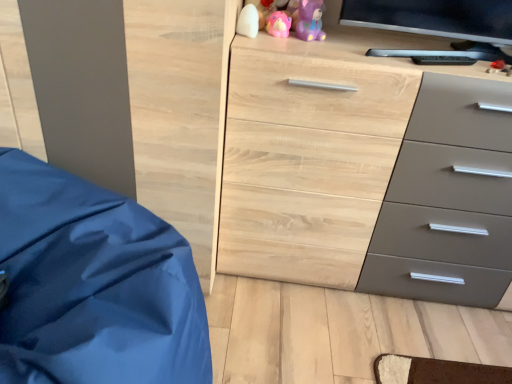
This screenshot has height=384, width=512. I want to click on light wood/texture chest of drawers at center, so click(312, 152).

This screenshot has width=512, height=384. Describe the element at coordinates (93, 285) in the screenshot. I see `blue fabric at left` at that location.

Identify the location of blue fabric at left. (93, 285).

Find the location of a particular element. The width and height of the screenshot is (512, 384). light wood/texture chest of drawers at center is located at coordinates (312, 152).

Which object is further away from the camera, blue fabric at left or white matte pillow at upper center, which appears as the 1th toy when viewed from the left?

white matte pillow at upper center, which appears as the 1th toy when viewed from the left, is more distant.

Can you see blue fabric at left touching white matte pillow at upper center, the 3th toy in the right-to-left sequence?

→ No, blue fabric at left is not touching white matte pillow at upper center, the 3th toy in the right-to-left sequence.

Does blue fabric at left have a lesser height compared to white matte pillow at upper center, which appears as the 1th toy when viewed from the left?

No.

Considering the relative sizes of blue fabric at left and white matte pillow at upper center, which appears as the 1th toy when viewed from the left, in the image provided, is blue fabric at left wider than white matte pillow at upper center, which appears as the 1th toy when viewed from the left,?

Indeed, blue fabric at left has a greater width compared to white matte pillow at upper center, which appears as the 1th toy when viewed from the left.

From a real-world perspective, is blue fabric at left above or below light wood/texture chest of drawers at center?

In terms of real-world spatial position, blue fabric at left is below light wood/texture chest of drawers at center.

Does blue fabric at left have a smaller size compared to light wood/texture chest of drawers at center?

Yes, blue fabric at left is smaller than light wood/texture chest of drawers at center.

Considering the sizes of objects blue fabric at left and light wood/texture chest of drawers at center in the image provided, who is shorter, blue fabric at left or light wood/texture chest of drawers at center?

blue fabric at left is shorter.

Would you say blue fabric at left is a long distance from light wood/texture chest of drawers at center?

That's not correct — blue fabric at left is a little close to light wood/texture chest of drawers at center.

Which object is closer to the camera taking this photo, light wood/texture chest of drawers at center or pink rubber duck at upper center, which is counted as the 2th toy, starting from the right?

light wood/texture chest of drawers at center is more forward.

Identify the location of the chest of drawers that is under the pink rubber duck at upper center, which is counted as the 2th toy, starting from the right (from a real-world perspective). (312, 152).

From the image's perspective, which object appears higher, light wood/texture chest of drawers at center or pink rubber duck at upper center, the second toy from the left?

pink rubber duck at upper center, the second toy from the left.

Considering the relative sizes of light wood/texture chest of drawers at center and pink rubber duck at upper center, which is counted as the 2th toy, starting from the right, in the image provided, is light wood/texture chest of drawers at center bigger than pink rubber duck at upper center, which is counted as the 2th toy, starting from the right,?

Yes.

Is white matte pillow at upper center, which appears as the 1th toy when viewed from the left, wider or thinner than blue fabric at left?

In the image, white matte pillow at upper center, which appears as the 1th toy when viewed from the left, appears to be more narrow than blue fabric at left.

Is white matte pillow at upper center, which appears as the 1th toy when viewed from the left, inside or outside of blue fabric at left?

white matte pillow at upper center, which appears as the 1th toy when viewed from the left, lies outside blue fabric at left.

Which of these two, white matte pillow at upper center, the 3th toy in the right-to-left sequence, or blue fabric at left, is bigger?

With larger size is blue fabric at left.

The image size is (512, 384). I want to click on furniture that appears in front of the white matte pillow at upper center, the 3th toy in the right-to-left sequence, so click(x=93, y=285).

Can you tell me how much white matte pillow at upper center, the 3th toy in the right-to-left sequence, and purple matte bear at upper center, acting as the first toy starting from the right, differ in facing direction?

There is a 0.000838-degree angle between the facing directions of white matte pillow at upper center, the 3th toy in the right-to-left sequence, and purple matte bear at upper center, acting as the first toy starting from the right.

From a real-world perspective, is white matte pillow at upper center, the 3th toy in the right-to-left sequence, above or below purple matte bear at upper center, the third toy when ordered from left to right?

white matte pillow at upper center, the 3th toy in the right-to-left sequence, is situated lower than purple matte bear at upper center, the third toy when ordered from left to right, in the real world.

Is white matte pillow at upper center, the 3th toy in the right-to-left sequence, bigger than purple matte bear at upper center, the third toy when ordered from left to right?

No, white matte pillow at upper center, the 3th toy in the right-to-left sequence, is not bigger than purple matte bear at upper center, the third toy when ordered from left to right.

You are a GUI agent. You are given a task and a screenshot of the screen. Output one action in this format:
    pyautogui.click(x=<x>, y=<y>)
    Task: Click on the toy that is the 2nd object located below the purple matte bear at upper center, the third toy when ordered from left to right (from the image's perspective)
    
    Given the screenshot: What is the action you would take?
    pyautogui.click(x=248, y=21)

Are purple matte bear at upper center, acting as the first toy starting from the right, and pink rubber duck at upper center, which is counted as the 2th toy, starting from the right, far apart?

No, purple matte bear at upper center, acting as the first toy starting from the right, is in close proximity to pink rubber duck at upper center, which is counted as the 2th toy, starting from the right.

From a real-world perspective, who is located higher, purple matte bear at upper center, the third toy when ordered from left to right, or pink rubber duck at upper center, the second toy from the left?

From a 3D spatial view, purple matte bear at upper center, the third toy when ordered from left to right, is above.

Is purple matte bear at upper center, the third toy when ordered from left to right, turned away from pink rubber duck at upper center, the second toy from the left?

No, purple matte bear at upper center, the third toy when ordered from left to right, is not facing away from pink rubber duck at upper center, the second toy from the left.

How different are the orientations of light wood/texture chest of drawers at center and blue fabric at left in degrees?

They differ by 0.344 degrees in their facing directions.

Which is behind, light wood/texture chest of drawers at center or blue fabric at left?

light wood/texture chest of drawers at center is further from the camera.

In the image, is light wood/texture chest of drawers at center on the left side or the right side of blue fabric at left?

light wood/texture chest of drawers at center is to the right of blue fabric at left.

In the scene shown: Considering the sizes of objects light wood/texture chest of drawers at center and blue fabric at left in the image provided, who is taller, light wood/texture chest of drawers at center or blue fabric at left?

light wood/texture chest of drawers at center is taller.

The width and height of the screenshot is (512, 384). In the image, there is a white matte pillow at upper center, which appears as the 1th toy when viewed from the left. Identify the location of furniture below it (from a real-world perspective). (93, 285).

Image resolution: width=512 pixels, height=384 pixels. I want to click on furniture in front of the light wood/texture chest of drawers at center, so click(x=93, y=285).

Considering their positions, is light wood/texture chest of drawers at center positioned closer to pink rubber duck at upper center, which is counted as the 2th toy, starting from the right, than white matte pillow at upper center, which appears as the 1th toy when viewed from the left?

white matte pillow at upper center, which appears as the 1th toy when viewed from the left.

Which object lies nearer to the anchor point white matte pillow at upper center, the 3th toy in the right-to-left sequence, pink rubber duck at upper center, which is counted as the 2th toy, starting from the right, or light wood/texture chest of drawers at center?

Among the two, pink rubber duck at upper center, which is counted as the 2th toy, starting from the right, is located nearer to white matte pillow at upper center, the 3th toy in the right-to-left sequence.

When comparing their distances from pink rubber duck at upper center, which is counted as the 2th toy, starting from the right, does white matte pillow at upper center, the 3th toy in the right-to-left sequence, or purple matte bear at upper center, the third toy when ordered from left to right, seem further?

Based on the image, white matte pillow at upper center, the 3th toy in the right-to-left sequence, appears to be further to pink rubber duck at upper center, which is counted as the 2th toy, starting from the right.

Based on their spatial positions, is pink rubber duck at upper center, which is counted as the 2th toy, starting from the right, or light wood/texture chest of drawers at center further from blue fabric at left?

pink rubber duck at upper center, which is counted as the 2th toy, starting from the right.

Based on their spatial positions, is blue fabric at left or light wood/texture chest of drawers at center further from white matte pillow at upper center, which appears as the 1th toy when viewed from the left?

blue fabric at left.

Considering their positions, is purple matte bear at upper center, acting as the first toy starting from the right, positioned further to white matte pillow at upper center, the 3th toy in the right-to-left sequence, than pink rubber duck at upper center, which is counted as the 2th toy, starting from the right?

purple matte bear at upper center, acting as the first toy starting from the right, is positioned further to the anchor white matte pillow at upper center, the 3th toy in the right-to-left sequence.

From the image, which object appears to be nearer to purple matte bear at upper center, acting as the first toy starting from the right, light wood/texture chest of drawers at center or blue fabric at left?

light wood/texture chest of drawers at center is positioned closer to the anchor purple matte bear at upper center, acting as the first toy starting from the right.

Which object lies further to the anchor point purple matte bear at upper center, acting as the first toy starting from the right, light wood/texture chest of drawers at center or white matte pillow at upper center, which appears as the 1th toy when viewed from the left?

The object further to purple matte bear at upper center, acting as the first toy starting from the right, is light wood/texture chest of drawers at center.

Where is `toy between white matte pillow at upper center, which appears as the 1th toy when viewed from the left, and purple matte bear at upper center, the third toy when ordered from left to right, in the horizontal direction`? toy between white matte pillow at upper center, which appears as the 1th toy when viewed from the left, and purple matte bear at upper center, the third toy when ordered from left to right, in the horizontal direction is located at coordinates (278, 24).

The image size is (512, 384). What are the coordinates of `toy between pink rubber duck at upper center, the second toy from the left, and blue fabric at left from top to bottom` in the screenshot? It's located at (248, 21).